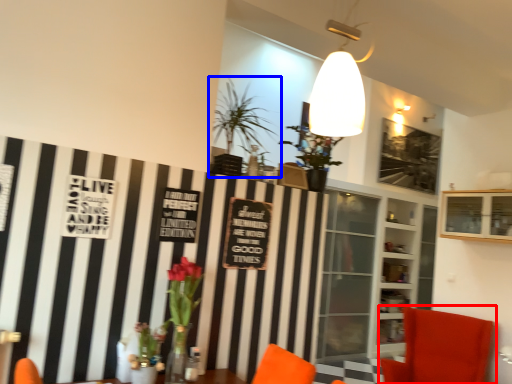
Question: Which of the following is the closest to the observer, chair (highlighted by a red box) or houseplant (highlighted by a blue box)?

Choices:
 (A) chair
 (B) houseplant

Answer: (B)